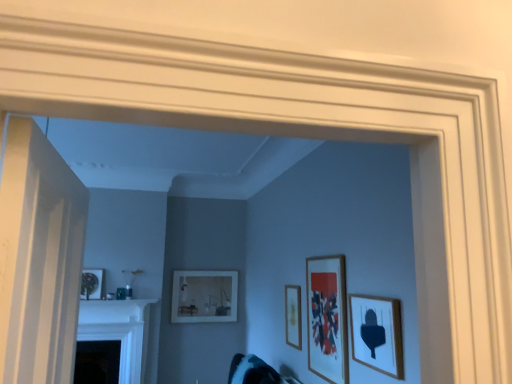
Question: From the image's perspective, is teal fabric swivel chair at lower center beneath black glossy fireplace at lower left?

Choices:
 (A) no
 (B) yes

Answer: (A)

Question: From a real-world perspective, is teal fabric swivel chair at lower center located beneath black glossy fireplace at lower left?

Choices:
 (A) yes
 (B) no

Answer: (A)

Question: Is black glossy fireplace at lower left inside teal fabric swivel chair at lower center?

Choices:
 (A) no
 (B) yes

Answer: (A)

Question: Considering the relative sizes of teal fabric swivel chair at lower center and black glossy fireplace at lower left in the image provided, is teal fabric swivel chair at lower center wider than black glossy fireplace at lower left?

Choices:
 (A) no
 (B) yes

Answer: (B)

Question: Can you confirm if teal fabric swivel chair at lower center is taller than black glossy fireplace at lower left?

Choices:
 (A) yes
 (B) no

Answer: (B)

Question: In the image, is wooden picture frame at center, which is the 2th picture frame in left-to-right order, positioned in front of or behind teal fabric swivel chair at lower center?

Choices:
 (A) behind
 (B) front

Answer: (A)

Question: Would you say wooden picture frame at center, marked as the third picture frame in a front-to-back arrangement, is inside or outside teal fabric swivel chair at lower center?

Choices:
 (A) inside
 (B) outside

Answer: (B)

Question: Is wooden picture frame at center, which is the 2th picture frame in left-to-right order, to the left or to the right of teal fabric swivel chair at lower center in the image?

Choices:
 (A) left
 (B) right

Answer: (B)

Question: Is point (x=296, y=306) closer or farther from the camera than point (x=268, y=379)?

Choices:
 (A) farther
 (B) closer

Answer: (A)

Question: Looking at their shapes, would you say wooden picture frame at center, marked as the third picture frame in a front-to-back arrangement, is wider or thinner than matte white picture frame at center, the fourth picture frame when ordered from right to left?

Choices:
 (A) thin
 (B) wide

Answer: (A)

Question: From their relative heights in the image, would you say wooden picture frame at center, marked as the third picture frame in a front-to-back arrangement, is taller or shorter than matte white picture frame at center, the fourth picture frame when ordered from right to left?

Choices:
 (A) short
 (B) tall

Answer: (A)

Question: Considering their positions, is wooden picture frame at center, marked as the third picture frame in a front-to-back arrangement, located in front of or behind matte white picture frame at center, the fourth picture frame when ordered from front to back?

Choices:
 (A) behind
 (B) front

Answer: (B)

Question: From a real-world perspective, relative to matte white picture frame at center, the fourth picture frame when ordered from front to back, is wooden picture frame at center, marked as the third picture frame in a front-to-back arrangement, vertically above or below?

Choices:
 (A) below
 (B) above

Answer: (A)

Question: From the image's perspective, is black glossy fireplace at lower left above or below matte wooden picture frame at center, the third picture frame from the left?

Choices:
 (A) above
 (B) below

Answer: (B)

Question: Is point pos(155,299) positioned closer to the camera than point pos(324,274)?

Choices:
 (A) farther
 (B) closer

Answer: (A)